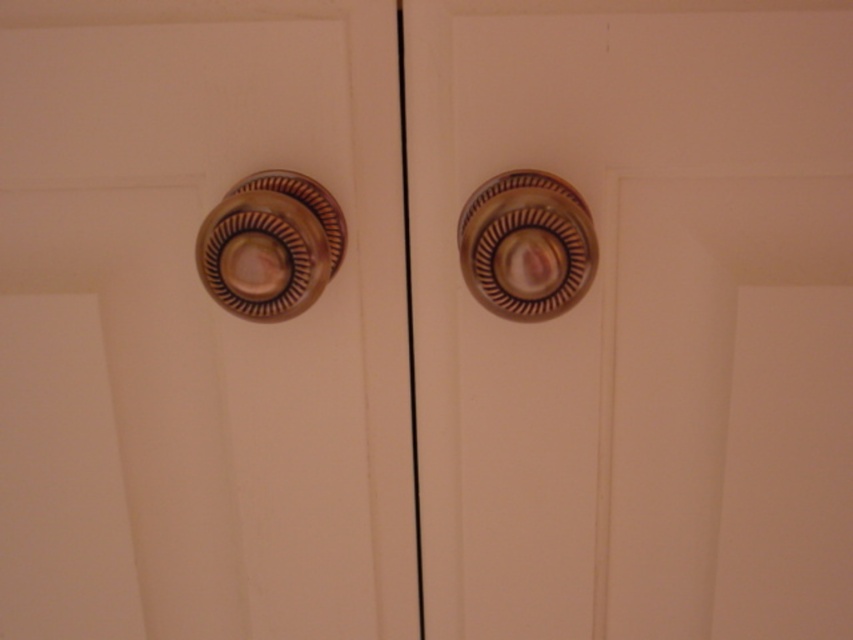
Who is taller, metallic brass knob at center or metallic brass knob at center-right?

metallic brass knob at center

Is point (376, 433) behind point (471, 256)?

Yes, it is behind point (471, 256).

Identify the location of metallic brass knob at center. This screenshot has width=853, height=640. (196, 326).

Between point (375, 179) and point (242, 182), which one is positioned behind?

Positioned behind is point (375, 179).

Is metallic brass knob at center further to camera compared to brass textured knob at upper left?

That is True.

Does point (378, 86) lie behind point (225, 246)?

Yes, it is.

Find the location of a particular element. This screenshot has height=640, width=853. metallic brass knob at center is located at coordinates (196, 326).

How distant is metallic knob at center from metallic brass knob at center?

metallic knob at center and metallic brass knob at center are 5.32 inches apart.

Who is more forward, (780, 257) or (212, 461)?

Point (780, 257) is in front.

Where is `metallic knob at center`? The height and width of the screenshot is (640, 853). metallic knob at center is located at coordinates (639, 321).